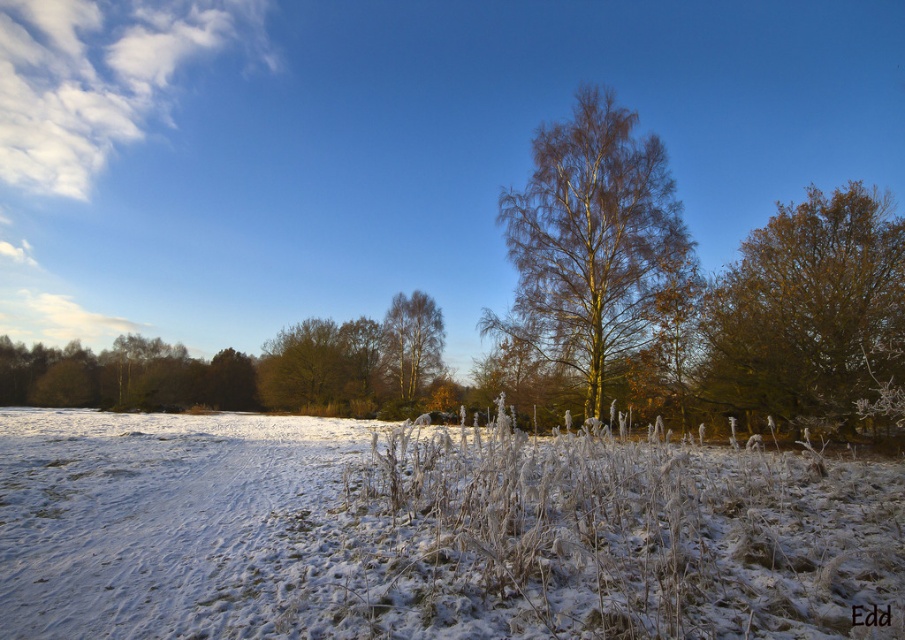
Question: Which of the following is the farthest from the observer?

Choices:
 (A) white frosty grass at center
 (B) brown textured tree at right

Answer: (B)

Question: Can you confirm if brown textured tree at right is smaller than smooth silver birch at center?

Choices:
 (A) no
 (B) yes

Answer: (A)

Question: Can you confirm if golden-brown bark tree at center is positioned above smooth silver birch at center?

Choices:
 (A) yes
 (B) no

Answer: (A)

Question: Considering the real-world distances, which object is closest to the brown textured tree at right?

Choices:
 (A) white frosty grass at center
 (B) smooth silver birch at center

Answer: (A)

Question: Which object appears farthest from the camera in this image?

Choices:
 (A) white frosty grass at center
 (B) smooth silver birch at center
 (C) brown textured tree at right
 (D) golden-brown bark tree at center

Answer: (B)

Question: Does brown textured tree at right have a larger size compared to smooth silver birch at center?

Choices:
 (A) no
 (B) yes

Answer: (B)